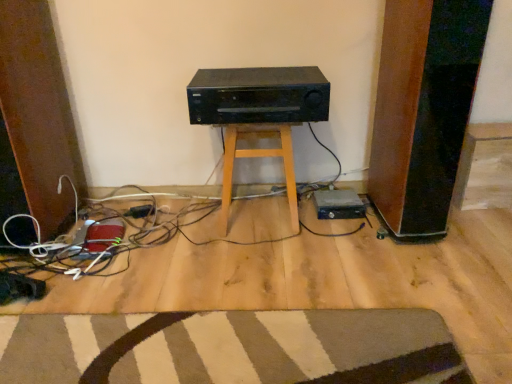
Identify the location of free space underneath striped carpet at lower center (from a real-world perspective). This screenshot has height=384, width=512. (194, 342).